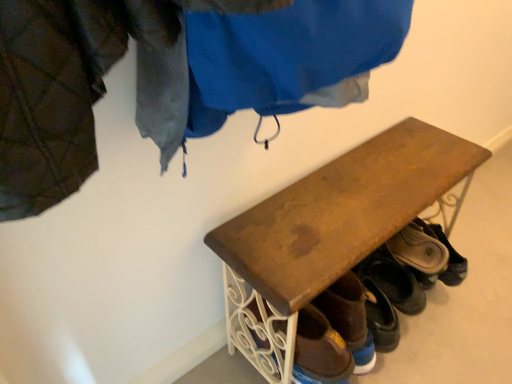
What do you see at coordinates (449, 255) in the screenshot?
I see `brown suede shoe at lower right, arranged as the 1th footwear when viewed from the back` at bounding box center [449, 255].

The image size is (512, 384). What do you see at coordinates (349, 319) in the screenshot?
I see `brown leather shoe at lower center, arranged as the 3th footwear when viewed from the right` at bounding box center [349, 319].

This screenshot has height=384, width=512. What do you see at coordinates (418, 250) in the screenshot?
I see `brown leather shoe at lower right, which is the 2th footwear from right to left` at bounding box center [418, 250].

Where is `wooden bench at center`? wooden bench at center is located at coordinates (331, 229).

What's the angular difference between brown suede shoe at lower right, which is counted as the 3th footwear, starting from the left, and brown leather shoe at lower center, the first footwear when ordered from left to right,'s facing directions?

The facing directions of brown suede shoe at lower right, which is counted as the 3th footwear, starting from the left, and brown leather shoe at lower center, the first footwear when ordered from left to right, are 0.00424 degrees apart.

Which is closer, (421, 279) or (337, 289)?

The point (337, 289) is more forward.

Is brown suede shoe at lower right, the 3th footwear from the front, situated inside brown leather shoe at lower center, the third footwear when ordered from back to front, or outside?

brown suede shoe at lower right, the 3th footwear from the front, cannot be found inside brown leather shoe at lower center, the third footwear when ordered from back to front.

Does brown suede shoe at lower right, the 3th footwear from the front, come behind brown leather shoe at lower center, the third footwear when ordered from back to front?

That is True.

From the picture: Considering the relative sizes of brown leather shoe at lower center, the first footwear when ordered from left to right, and wooden bench at center in the image provided, is brown leather shoe at lower center, the first footwear when ordered from left to right, thinner than wooden bench at center?

Yes.

Is brown leather shoe at lower center, arranged as the 3th footwear when viewed from the right, at the left side of wooden bench at center?

Yes, brown leather shoe at lower center, arranged as the 3th footwear when viewed from the right, is to the left of wooden bench at center.

Is brown leather shoe at lower center, arranged as the 3th footwear when viewed from the right, taller than wooden bench at center?

Incorrect, the height of brown leather shoe at lower center, arranged as the 3th footwear when viewed from the right, is not larger of that of wooden bench at center.

From the image's perspective, which one is positioned higher, brown leather shoe at lower center, the third footwear when ordered from back to front, or wooden bench at center?

wooden bench at center, from the image's perspective.

Does point (289, 315) lie in front of point (393, 243)?

Yes.

Is wooden bench at center further to camera compared to brown leather shoe at lower right, the second footwear in the left-to-right sequence?

No, wooden bench at center is closer to the camera.

Who is bigger, wooden bench at center or brown leather shoe at lower right, which is the 2th footwear from right to left?

wooden bench at center.

Would you say wooden bench at center is a long distance from brown leather shoe at lower right, the second footwear in the left-to-right sequence?

That's not correct — wooden bench at center is a little close to brown leather shoe at lower right, the second footwear in the left-to-right sequence.

Could you tell me if brown leather shoe at lower right, which is the 2th footwear from right to left, is turned towards brown leather shoe at lower center, the first footwear when ordered from left to right?

No, brown leather shoe at lower right, which is the 2th footwear from right to left, is not oriented towards brown leather shoe at lower center, the first footwear when ordered from left to right.

Can you tell me how much brown leather shoe at lower right, which is the 2th footwear from right to left, and brown leather shoe at lower center, the first footwear when ordered from left to right, differ in facing direction?

The facing directions of brown leather shoe at lower right, which is the 2th footwear from right to left, and brown leather shoe at lower center, the first footwear when ordered from left to right, are 0.00436 degrees apart.

Considering the points (446, 261) and (329, 296), which point is behind, point (446, 261) or point (329, 296)?

The point (446, 261) is behind.

From a real-world perspective, which footwear is the 1st one underneath the brown leather shoe at lower center, placed as the first footwear when sorted from front to back? Please provide its 2D coordinates.

[(418, 250)]

Does brown leather shoe at lower center, arranged as the 3th footwear when viewed from the right, have a greater height compared to brown leather shoe at lower right, the second footwear in the left-to-right sequence?

Yes.

From a real-world perspective, which object rests below the other?

From a 3D spatial view, brown leather shoe at lower right, which is the 2th footwear from right to left, is below.

Does brown leather shoe at lower center, the third footwear when ordered from back to front, have a greater width compared to brown leather shoe at lower right, placed as the 2th footwear when sorted from front to back?

No.

Which is in front, point (358, 288) or point (407, 237)?

Point (358, 288)

From a real-world perspective, is brown suede shoe at lower right, arranged as the 1th footwear when viewed from the back, on brown leather shoe at lower right, which is the 2th footwear from right to left?

No, from a real-world perspective, brown suede shoe at lower right, arranged as the 1th footwear when viewed from the back, is not on top of brown leather shoe at lower right, which is the 2th footwear from right to left.

Is brown suede shoe at lower right, arranged as the 1th footwear when viewed from the back, facing away from brown leather shoe at lower right, placed as the 2th footwear when sorted from front to back?

No, brown suede shoe at lower right, arranged as the 1th footwear when viewed from the back, is not facing the opposite direction of brown leather shoe at lower right, placed as the 2th footwear when sorted from front to back.

From the image's perspective, which is below, brown suede shoe at lower right, arranged as the 1th footwear when viewed from the back, or brown leather shoe at lower right, placed as the 2th footwear when sorted from front to back?

From the image's view, brown suede shoe at lower right, arranged as the 1th footwear when viewed from the back, is below.

Which is behind, brown suede shoe at lower right, the 3th footwear from the front, or brown leather shoe at lower right, which is the 2th footwear from right to left?

brown suede shoe at lower right, the 3th footwear from the front, is more distant.

Is wooden bench at center outside of brown suede shoe at lower right, which is counted as the 3th footwear, starting from the left?

That's correct, wooden bench at center is outside of brown suede shoe at lower right, which is counted as the 3th footwear, starting from the left.

Which of these two, wooden bench at center or brown suede shoe at lower right, the 1th footwear viewed from the right, stands taller?

With more height is wooden bench at center.

Based on the photo, from a real-world perspective, between wooden bench at center and brown suede shoe at lower right, arranged as the 1th footwear when viewed from the back, who is vertically lower?

brown suede shoe at lower right, arranged as the 1th footwear when viewed from the back, is physically lower.

Image resolution: width=512 pixels, height=384 pixels. Identify the location of the 2nd footwear below the brown leather shoe at lower center, placed as the first footwear when sorted from front to back (from a real-world perspective). (449, 255).

This screenshot has height=384, width=512. Identify the location of furniture on the right of brown leather shoe at lower center, arranged as the 3th footwear when viewed from the right. (331, 229).

Which object lies further to the anchor point wooden bench at center, brown leather shoe at lower center, the first footwear when ordered from left to right, or brown suede shoe at lower right, the 3th footwear from the front?

brown suede shoe at lower right, the 3th footwear from the front, is further to wooden bench at center.

Considering their positions, is brown leather shoe at lower center, the third footwear when ordered from back to front, positioned further to brown suede shoe at lower right, which is counted as the 3th footwear, starting from the left, than wooden bench at center?

wooden bench at center is positioned further to the anchor brown suede shoe at lower right, which is counted as the 3th footwear, starting from the left.

Which object lies further to the anchor point brown leather shoe at lower center, placed as the first footwear when sorted from front to back, wooden bench at center or brown leather shoe at lower right, the second footwear viewed from the back?

brown leather shoe at lower right, the second footwear viewed from the back.

Based on their spatial positions, is brown leather shoe at lower right, which is the 2th footwear from right to left, or brown suede shoe at lower right, the 3th footwear from the front, closer to wooden bench at center?

brown leather shoe at lower right, which is the 2th footwear from right to left, lies closer to wooden bench at center than the other object.

Looking at the image, which one is located further to brown leather shoe at lower center, the third footwear when ordered from back to front, brown suede shoe at lower right, which is counted as the 3th footwear, starting from the left, or brown leather shoe at lower right, the second footwear viewed from the back?

brown suede shoe at lower right, which is counted as the 3th footwear, starting from the left.

Looking at the image, which one is located further to brown leather shoe at lower center, the third footwear when ordered from back to front, wooden bench at center or brown suede shoe at lower right, the 1th footwear viewed from the right?

brown suede shoe at lower right, the 1th footwear viewed from the right, lies further to brown leather shoe at lower center, the third footwear when ordered from back to front, than the other object.

Based on their spatial positions, is brown suede shoe at lower right, arranged as the 1th footwear when viewed from the back, or brown leather shoe at lower center, the first footwear when ordered from left to right, further from brown leather shoe at lower right, the second footwear in the left-to-right sequence?

brown leather shoe at lower center, the first footwear when ordered from left to right, is positioned further to the anchor brown leather shoe at lower right, the second footwear in the left-to-right sequence.

Considering their positions, is wooden bench at center positioned further to brown suede shoe at lower right, arranged as the 1th footwear when viewed from the back, than brown leather shoe at lower right, placed as the 2th footwear when sorted from front to back?

wooden bench at center.

Locate an element on the screen. Image resolution: width=512 pixels, height=384 pixels. footwear between wooden bench at center and brown leather shoe at lower right, the second footwear viewed from the back, from front to back is located at coordinates tap(349, 319).

I want to click on footwear situated between brown leather shoe at lower center, placed as the first footwear when sorted from front to back, and brown suede shoe at lower right, which is counted as the 3th footwear, starting from the left, from left to right, so (x=418, y=250).